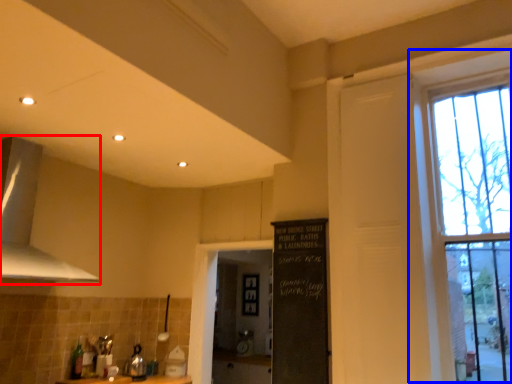
Question: Which point is further to the camera, exhaust hood (highlighted by a red box) or window (highlighted by a blue box)?

Choices:
 (A) exhaust hood
 (B) window

Answer: (A)